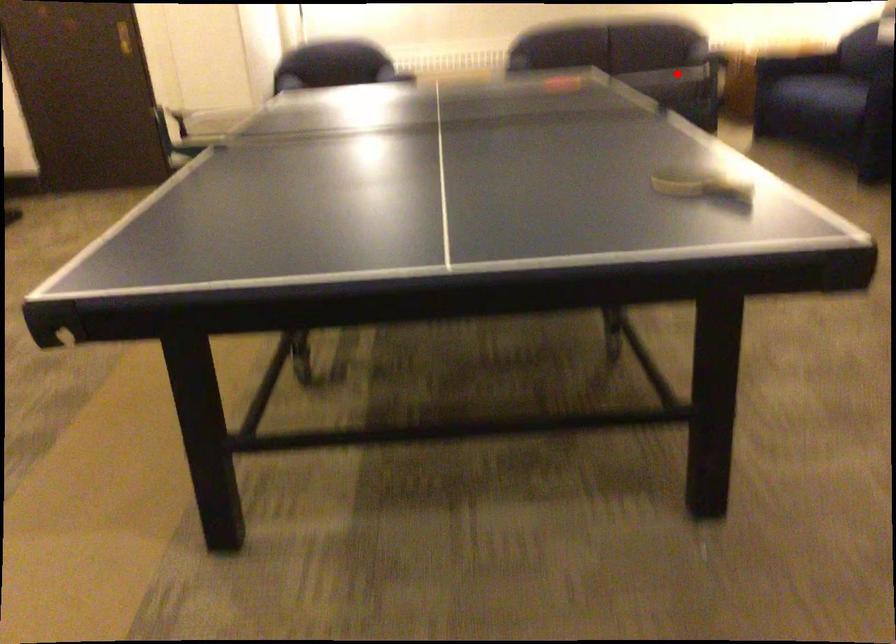
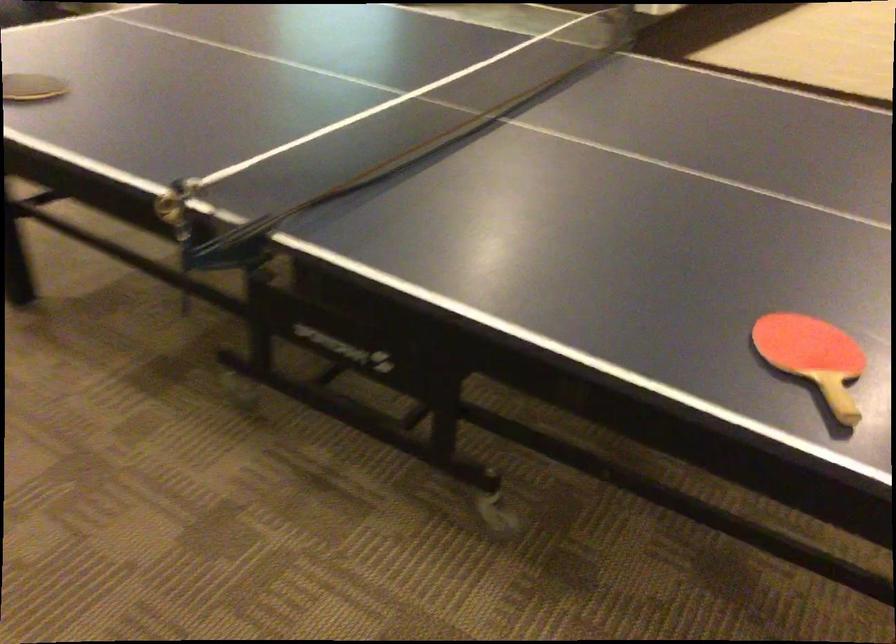
Where in the second image is the point corresponding to the highlighted location from the first image?

(174, 207)